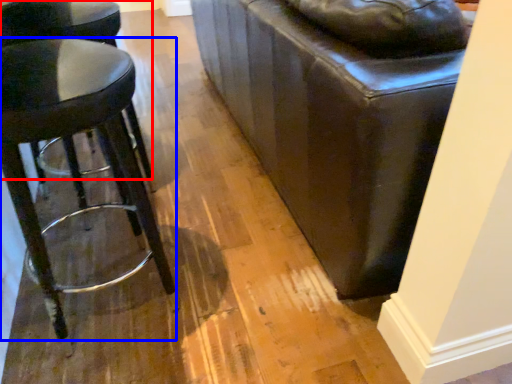
Question: Which object appears farthest to the camera in this image, stool (highlighted by a red box) or stool (highlighted by a blue box)?

Choices:
 (A) stool
 (B) stool

Answer: (A)